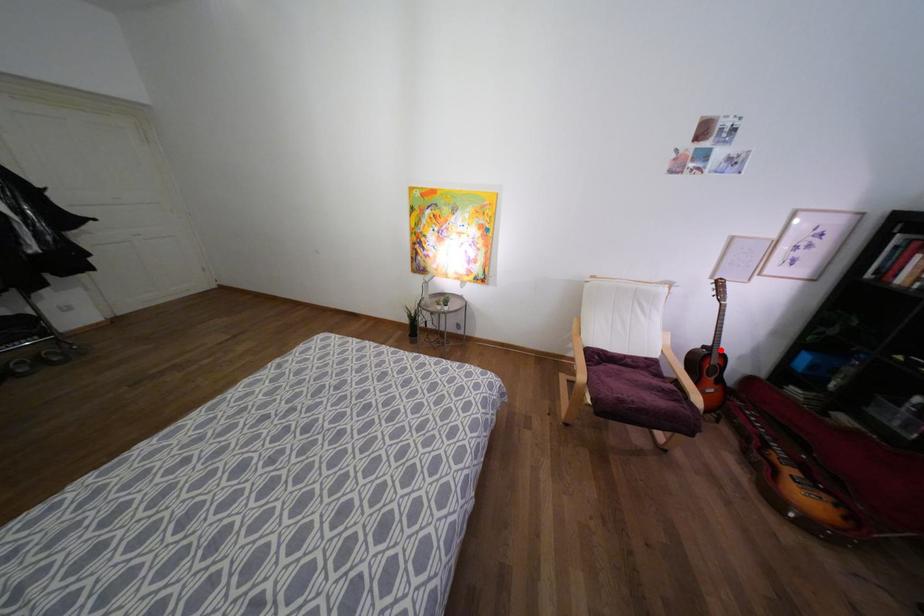
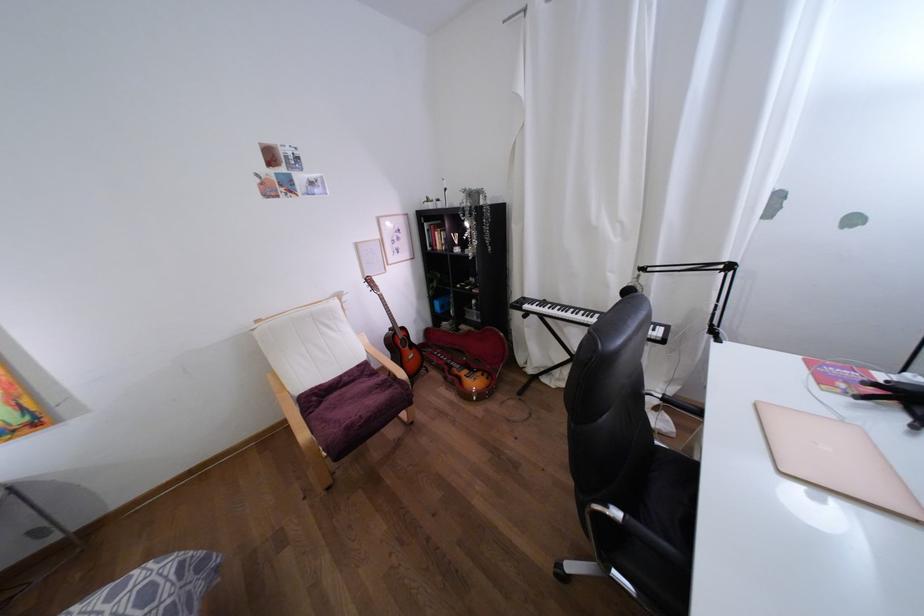
Where in the second image is the point corresponding to the highlighted location from the first image?

(398, 325)